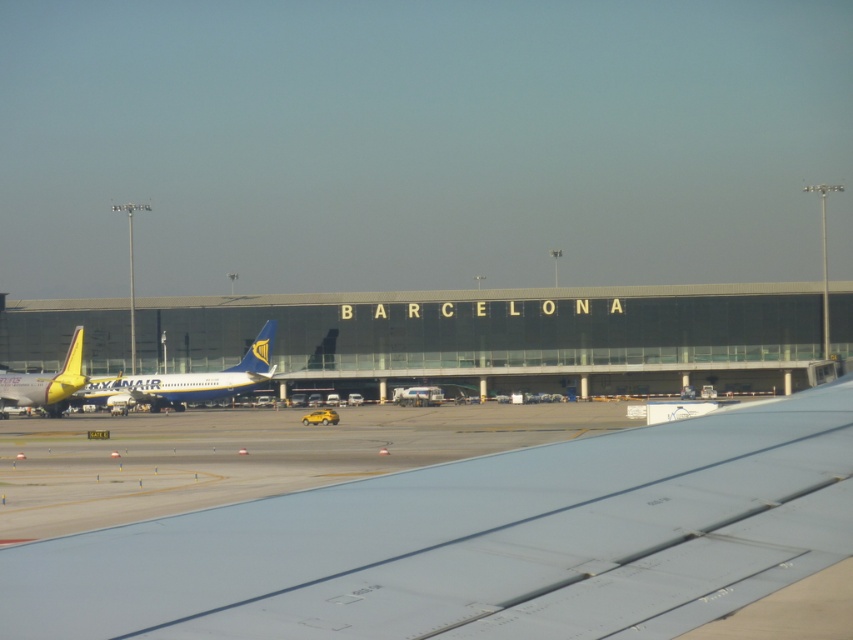
You are a passenger seated near the window on the aircraft and want to take a photo of the Ryanair airplane parked at the gate. You notice two points marked in the scene. Which point, point (32,628) or point (231,368), is closer to your camera lens?

Point (32,628) is closer to the camera lens than point (231,368).

You are a flight attendant standing at the back of the aircraft. You need to reach a point marked at coordinates point (x=792, y=566), which is near the wing. Can you walk directly to it from your current position?

The point (x=792, y=566) is 2.23 meters away from the camera, so yes, the flight attendant can walk directly to it as it is within a reachable distance.

You are a passenger sitting near the window and notice two objects outside your aircraft window. You see the metallic gray wing at lower center and the blue metallic airplane at center. Which object is positioned to the right of the other?

The metallic gray wing at lower center is positioned to the right of the blue metallic airplane at center.